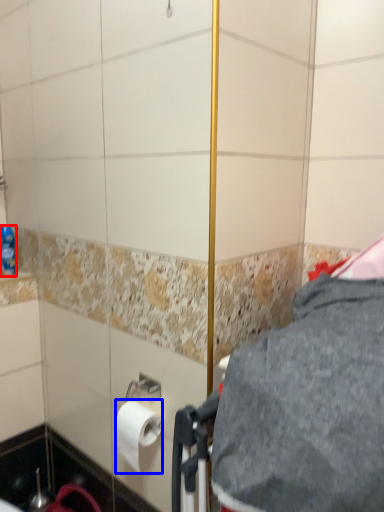
Question: Which of the following is the farthest to the observer, bottle (highlighted by a red box) or toilet paper (highlighted by a blue box)?

Choices:
 (A) bottle
 (B) toilet paper

Answer: (A)